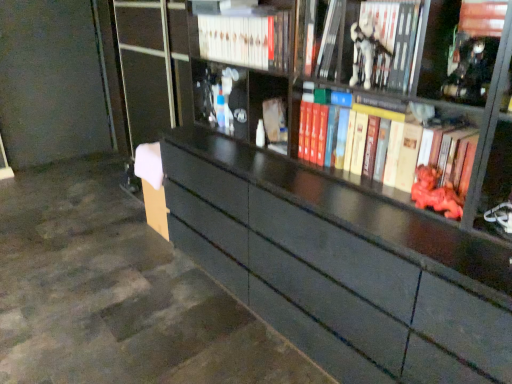
Question: Is matte white book at center turned away from metallic silver statue at upper right?

Choices:
 (A) yes
 (B) no

Answer: (B)

Question: From the image's perspective, is matte white book at center over metallic silver statue at upper right?

Choices:
 (A) no
 (B) yes

Answer: (A)

Question: Can you confirm if matte white book at center is thinner than metallic silver statue at upper right?

Choices:
 (A) no
 (B) yes

Answer: (A)

Question: From the image's perspective, is matte white book at center beneath metallic silver statue at upper right?

Choices:
 (A) no
 (B) yes

Answer: (B)

Question: Is matte white book at center shorter than metallic silver statue at upper right?

Choices:
 (A) no
 (B) yes

Answer: (B)

Question: From the image's perspective, is white matte figurine at upper center, the 2th book from the right, located above or below matte red statue at right, marked as the 2th toy in a left-to-right arrangement?

Choices:
 (A) below
 (B) above

Answer: (B)

Question: From a real-world perspective, relative to matte red statue at right, which ranks as the first toy in right-to-left order, is white matte figurine at upper center, the 3th book in the left-to-right sequence, vertically above or below?

Choices:
 (A) below
 (B) above

Answer: (B)

Question: Looking at the image, does white matte figurine at upper center, the 3th book in the left-to-right sequence, seem bigger or smaller compared to matte red statue at right, marked as the 2th toy in a left-to-right arrangement?

Choices:
 (A) small
 (B) big

Answer: (B)

Question: Is white matte figurine at upper center, the 3th book in the left-to-right sequence, taller or shorter than matte red statue at right, which appears as the second toy when viewed from the top?

Choices:
 (A) tall
 (B) short

Answer: (A)

Question: Is matte white book at center wider or thinner than metallic silver statue at upper right?

Choices:
 (A) wide
 (B) thin

Answer: (A)

Question: From the image's perspective, is matte white book at center above or below metallic silver statue at upper right?

Choices:
 (A) above
 (B) below

Answer: (B)

Question: Is point (264, 100) closer or farther from the camera than point (463, 82)?

Choices:
 (A) closer
 (B) farther

Answer: (B)

Question: Considering the relative positions of matte white book at center and metallic silver statue at upper right in the image provided, is matte white book at center to the left or to the right of metallic silver statue at upper right?

Choices:
 (A) right
 (B) left

Answer: (B)

Question: Do you think white matte figurine at upper center, which is counted as the 1th toy, starting from the left, is within white matte figurine at upper center, the 2th book from the right, or outside of it?

Choices:
 (A) outside
 (B) inside

Answer: (A)

Question: From a real-world perspective, relative to white matte figurine at upper center, the 3th book in the left-to-right sequence, is white matte figurine at upper center, which is counted as the 1th toy, starting from the left, vertically above or below?

Choices:
 (A) below
 (B) above

Answer: (A)